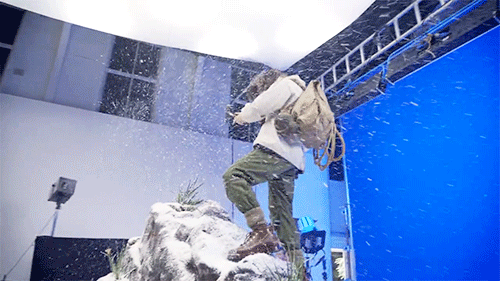
The image size is (500, 281). In order to click on large window in this screenshot , I will do `click(421, 120)`.